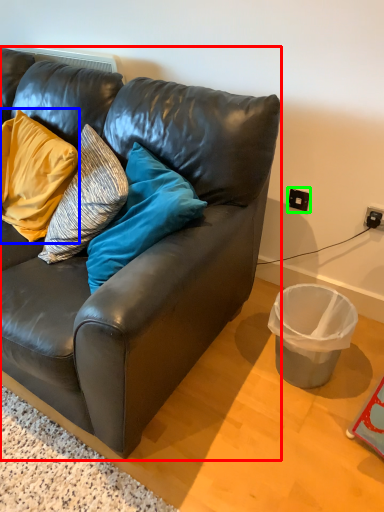
Question: Which is nearer to the studio couch (highlighted by a red box)? pillow (highlighted by a blue box) or power outlet (highlighted by a green box).

Choices:
 (A) pillow
 (B) power outlet

Answer: (A)